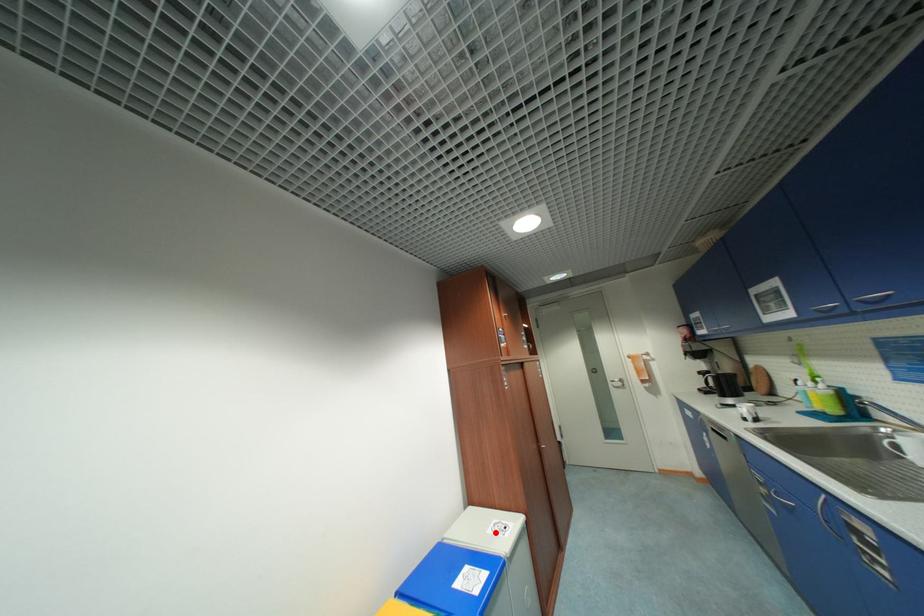
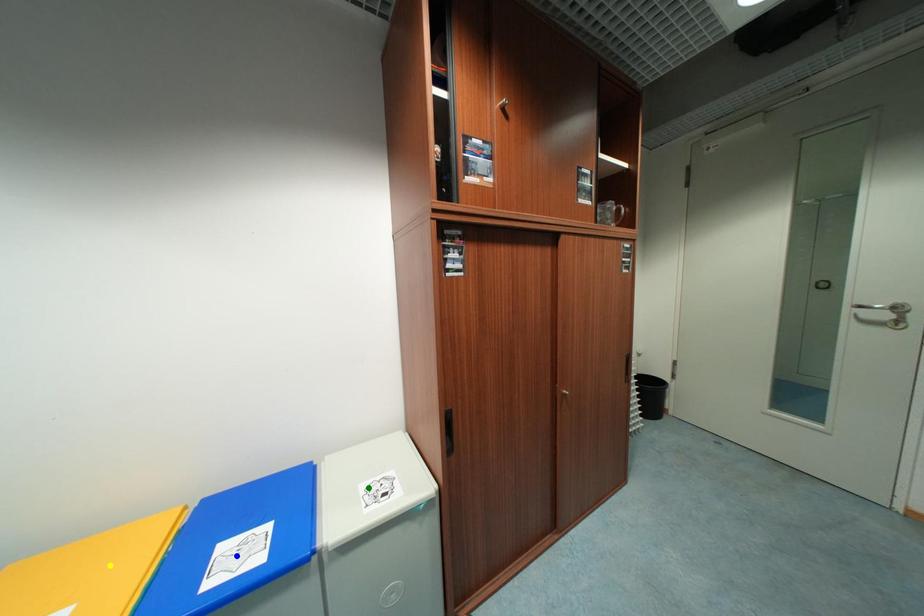
Question: I am providing you with two images of the same scene from different viewpoints. A red point is marked on the first image. You are given multiple points on the second image. Which spot in image 2 lines up with the point in image 1?

Choices:
 (A) yellow point
 (B) blue point
 (C) green point

Answer: (C)